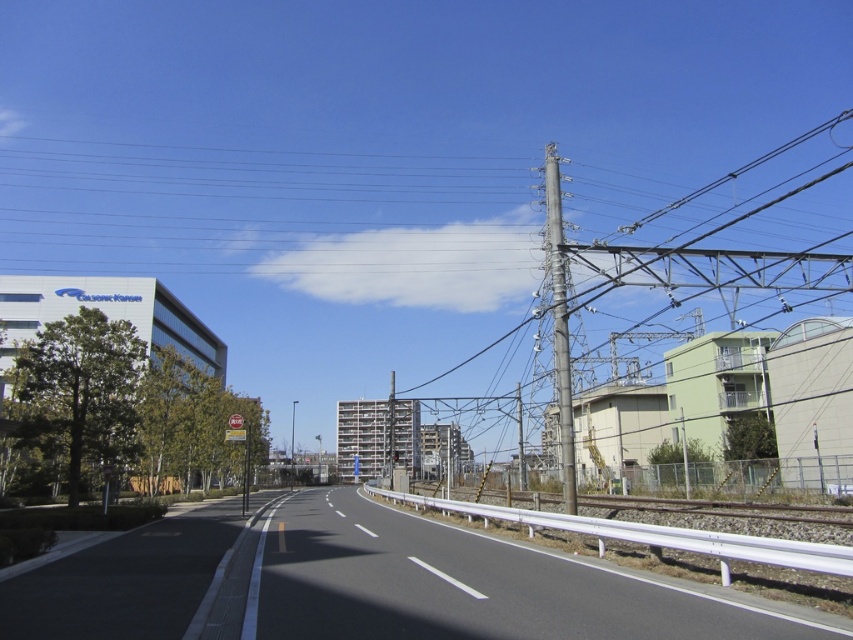
Is black asphalt highway at center further to camera compared to metallic gray pole at right?

That is False.

Is black asphalt highway at center shorter than metallic gray pole at right?

Correct, black asphalt highway at center is not as tall as metallic gray pole at right.

What do you see at coordinates (450, 586) in the screenshot? This screenshot has width=853, height=640. I see `black asphalt highway at center` at bounding box center [450, 586].

At what (x,y) coordinates should I click in order to perform the action: click on black asphalt highway at center. Please return your answer as a coordinate pair (x, y). Looking at the image, I should click on (450, 586).